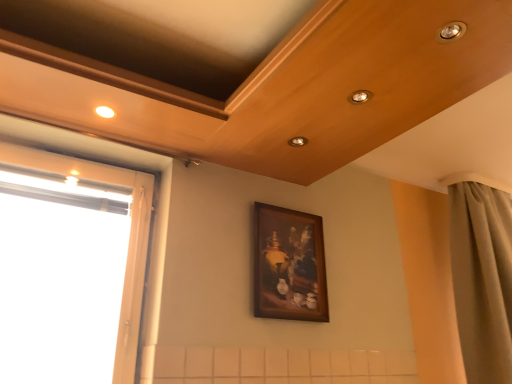
Question: Is matte beige curtain at right not inside transparent glass window at left?

Choices:
 (A) no
 (B) yes

Answer: (B)

Question: Is matte beige curtain at right to the left of transparent glass window at left from the viewer's perspective?

Choices:
 (A) no
 (B) yes

Answer: (A)

Question: Is matte beige curtain at right far from transparent glass window at left?

Choices:
 (A) no
 (B) yes

Answer: (B)

Question: Is matte beige curtain at right directly adjacent to transparent glass window at left?

Choices:
 (A) yes
 (B) no

Answer: (B)

Question: From the image's perspective, is matte beige curtain at right below transparent glass window at left?

Choices:
 (A) no
 (B) yes

Answer: (B)

Question: Is matte beige curtain at right looking in the opposite direction of transparent glass window at left?

Choices:
 (A) no
 (B) yes

Answer: (A)

Question: From the image's perspective, is wooden framed painting at center over matte beige curtain at right?

Choices:
 (A) no
 (B) yes

Answer: (B)

Question: Would you say wooden framed painting at center is a long distance from matte beige curtain at right?

Choices:
 (A) yes
 (B) no

Answer: (B)

Question: Are wooden framed painting at center and matte beige curtain at right beside each other?

Choices:
 (A) yes
 (B) no

Answer: (B)

Question: From a real-world perspective, is wooden framed painting at center located higher than matte beige curtain at right?

Choices:
 (A) yes
 (B) no

Answer: (B)

Question: Is wooden framed painting at center outside matte beige curtain at right?

Choices:
 (A) no
 (B) yes

Answer: (B)

Question: Does wooden framed painting at center contain matte beige curtain at right?

Choices:
 (A) no
 (B) yes

Answer: (A)

Question: Can you confirm if wooden framed painting at center is bigger than transparent glass window at left?

Choices:
 (A) yes
 (B) no

Answer: (B)